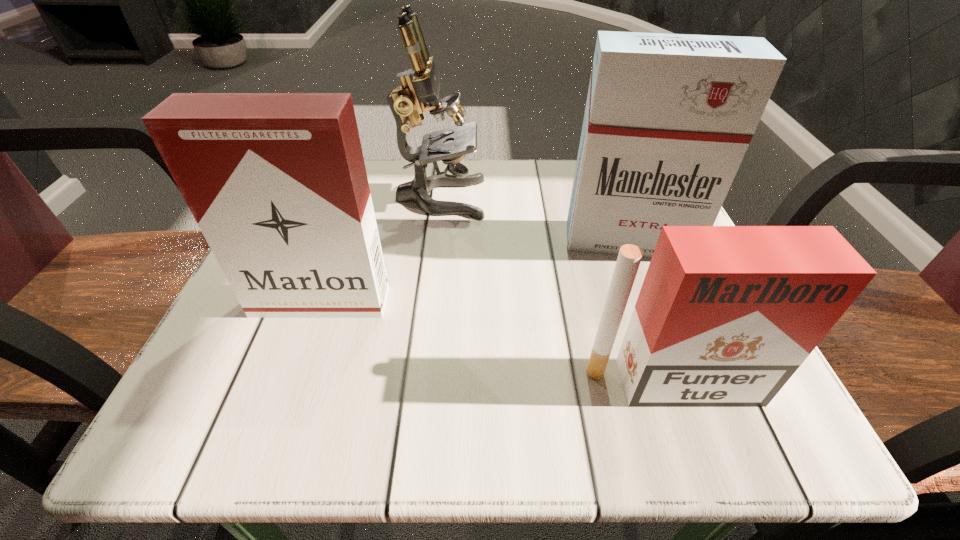
This screenshot has width=960, height=540. Identify the location of object present at the near edge. (725, 316).

You are a GUI agent. You are given a task and a screenshot of the screen. Output one action in this format:
    pyautogui.click(x=<x>, y=<y>)
    Task: Click on the object that is positioned at the left edge
    The width and height of the screenshot is (960, 540).
    Given the screenshot: What is the action you would take?
    pyautogui.click(x=277, y=183)

Identify the location of object that is at the near right corner. Image resolution: width=960 pixels, height=540 pixels. (725, 316).

The height and width of the screenshot is (540, 960). In the image, there is a desktop. Find the location of `free region at the far edge`. free region at the far edge is located at coordinates tap(495, 164).

In order to click on vacant space at the near edge of the desktop in this screenshot , I will do `click(558, 390)`.

This screenshot has width=960, height=540. I want to click on vacant space at the near left corner of the desktop, so [x=200, y=392].

Where is `empty space between the microscope and the shortest object`? Image resolution: width=960 pixels, height=540 pixels. empty space between the microscope and the shortest object is located at coordinates (556, 291).

Locate an element on the screen. Image resolution: width=960 pixels, height=540 pixels. free spot between the microscope and the second farthest object is located at coordinates (535, 219).

The height and width of the screenshot is (540, 960). Identify the location of vacant area that lies between the second farthest cigarette case and the shortest object. (496, 342).

The width and height of the screenshot is (960, 540). In order to click on free space between the leftmost cigarette case and the shortest object in this screenshot , I will do `click(496, 342)`.